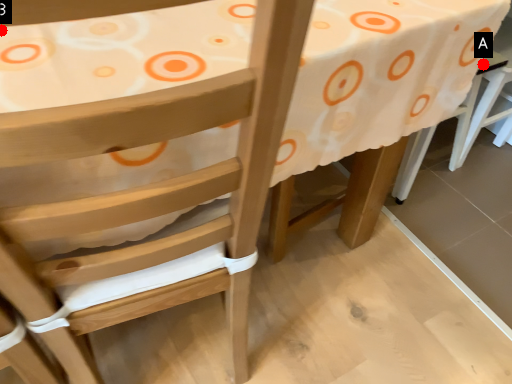
Question: Two points are circled on the image, labeled by A and B beside each circle. Which point is closer to the camera?

Choices:
 (A) A is closer
 (B) B is closer

Answer: (B)